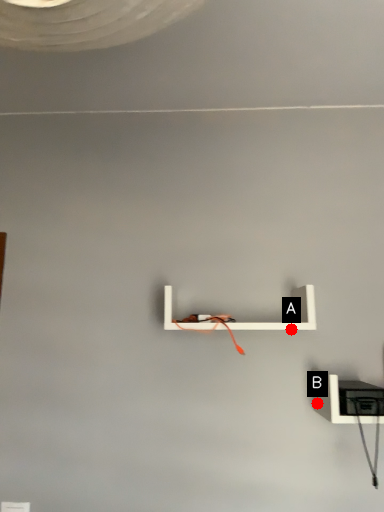
Question: Two points are circled on the image, labeled by A and B beside each circle. Which of the following is the closest to the observer?

Choices:
 (A) A is closer
 (B) B is closer

Answer: (A)